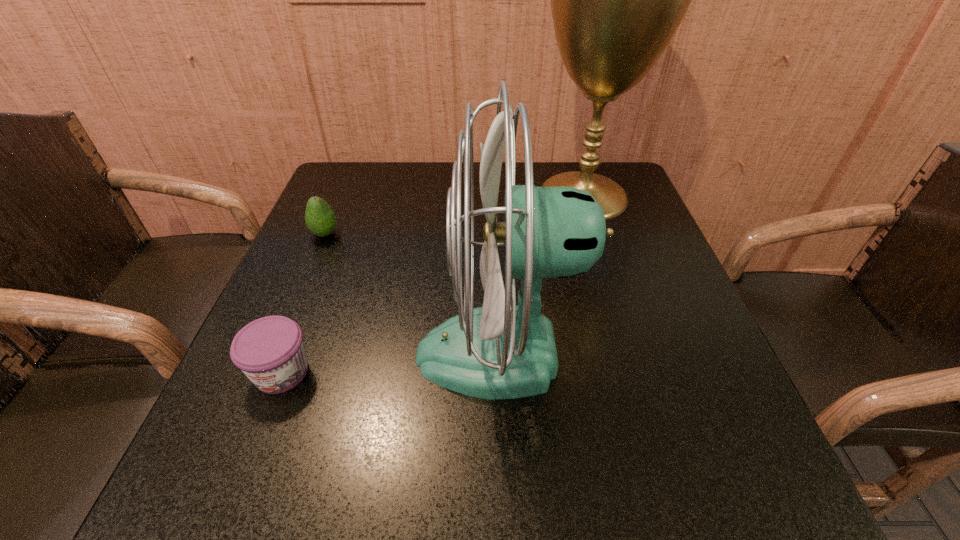
In the image, there is a desktop. Identify the location of vacant space at the near left corner. The width and height of the screenshot is (960, 540). (204, 502).

Where is `empty space between the jam and the avocado`? empty space between the jam and the avocado is located at coordinates (303, 303).

Locate an element on the screen. vacant area between the jam and the trophy cup is located at coordinates (432, 284).

Locate an element on the screen. This screenshot has height=540, width=960. free area in between the jam and the avocado is located at coordinates (303, 303).

Image resolution: width=960 pixels, height=540 pixels. Identify the location of vacant area between the fan and the avocado. (413, 294).

At what (x,y) coordinates should I click in order to perform the action: click on free area in between the tallest object and the jam. Please return your answer as a coordinate pair (x, y). Looking at the image, I should click on (432, 284).

What are the coordinates of `vacant space that's between the jam and the avocado` in the screenshot? It's located at (303, 303).

Locate an element on the screen. This screenshot has width=960, height=540. object that is the closest to the jam is located at coordinates (501, 350).

You are a GUI agent. You are given a task and a screenshot of the screen. Output one action in this format:
    pyautogui.click(x=<x>, y=<y>)
    Task: Click on the closest object to the tallest object
    
    Given the screenshot: What is the action you would take?
    pyautogui.click(x=501, y=350)

The image size is (960, 540). I want to click on vacant space that satisfies the following two spatial constraints: 1. on the back side of the avocado; 2. on the left side of the tallest object, so click(x=341, y=195).